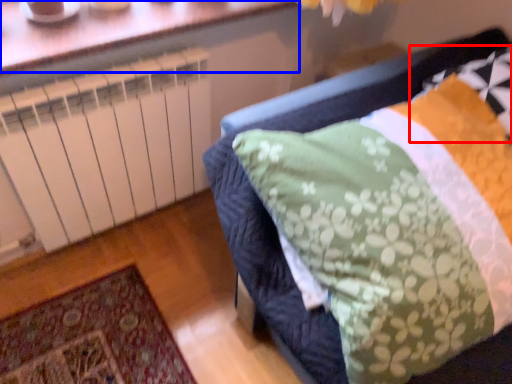
Question: Which of the following is the farthest to the observer, pillow (highlighted by a red box) or window (highlighted by a blue box)?

Choices:
 (A) pillow
 (B) window

Answer: (B)